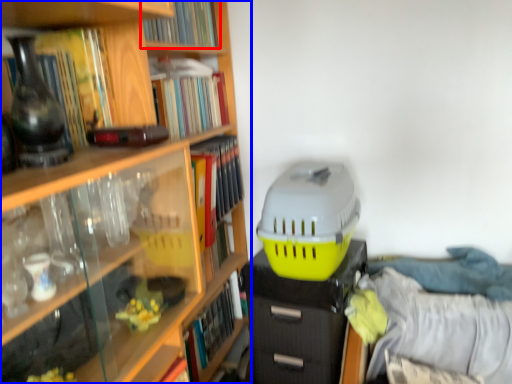
Question: Among these objects, which one is farthest to the camera, book (highlighted by a red box) or book (highlighted by a blue box)?

Choices:
 (A) book
 (B) book

Answer: (A)